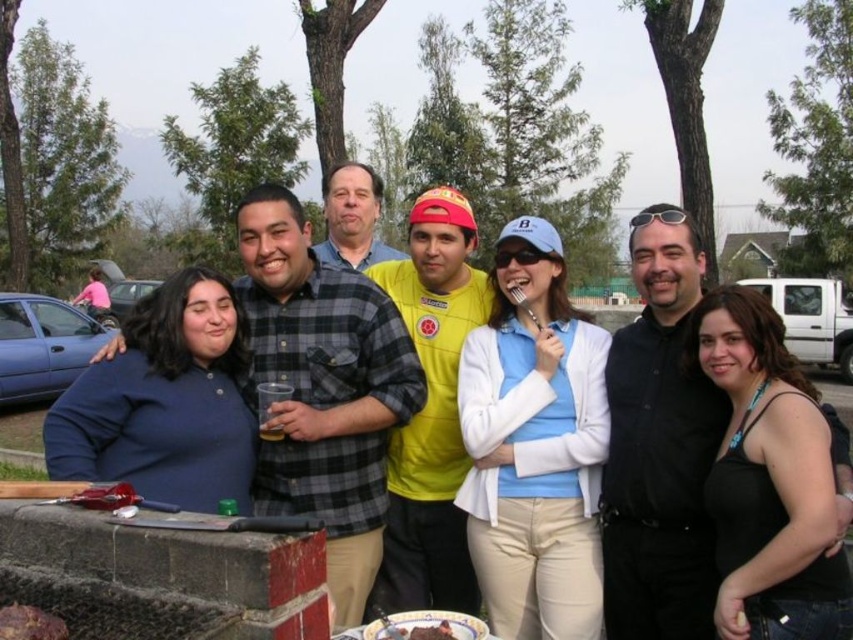
Image resolution: width=853 pixels, height=640 pixels. Describe the element at coordinates (422, 364) in the screenshot. I see `matte blue shirt at center` at that location.

Where is `matte blue shirt at center`? This screenshot has width=853, height=640. matte blue shirt at center is located at coordinates pos(422,364).

Is point (289, 284) positioned after point (25, 628)?

That is True.

Where is `matte blue shirt at center`? matte blue shirt at center is located at coordinates 422,364.

Which is above, matte blue shirt at center or chocolate cake at center?

matte blue shirt at center is higher up.

Who is positioned more to the left, matte blue shirt at center or chocolate cake at center?

From the viewer's perspective, matte blue shirt at center appears more on the left side.

Locate an element on the screen. The width and height of the screenshot is (853, 640). matte blue shirt at center is located at coordinates (422, 364).

Can you confirm if chocolate cake at center is positioned below smooth chocolate cake at lower left?

Yes, chocolate cake at center is below smooth chocolate cake at lower left.

Describe the element at coordinates (440, 624) in the screenshot. I see `chocolate cake at center` at that location.

Locate an element on the screen. chocolate cake at center is located at coordinates (440, 624).